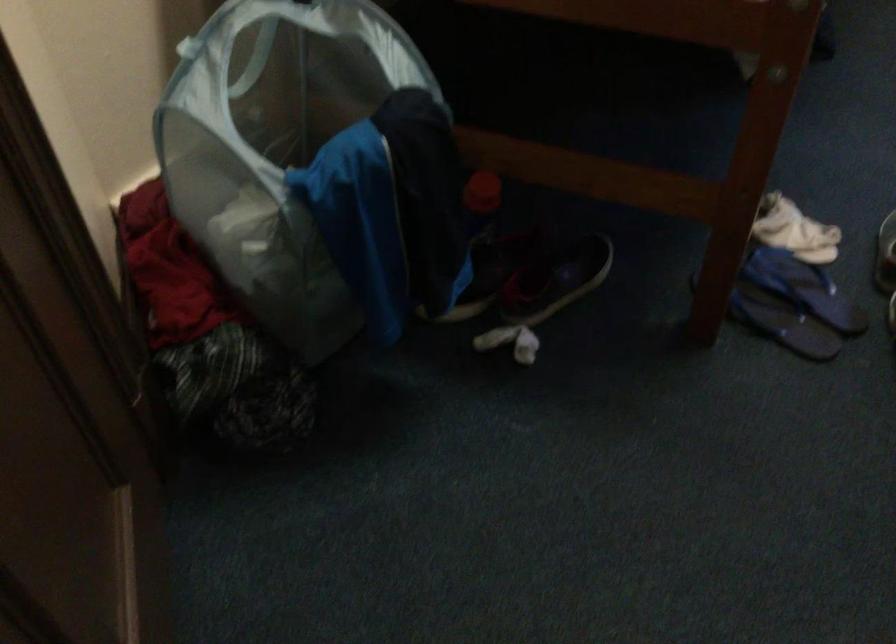
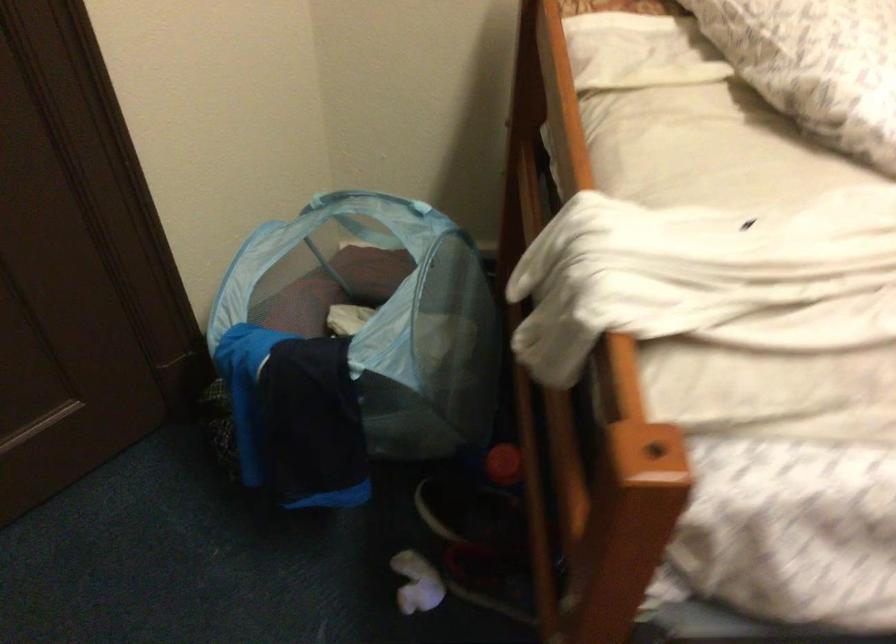
Locate, in the second image, the point that corresponds to the point at 394,100 in the first image.

(354, 345)